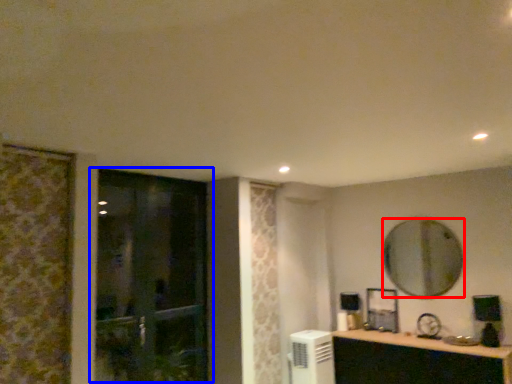
Question: Which point is further to the camera, mirror (highlighted by a red box) or door (highlighted by a blue box)?

Choices:
 (A) mirror
 (B) door

Answer: (A)